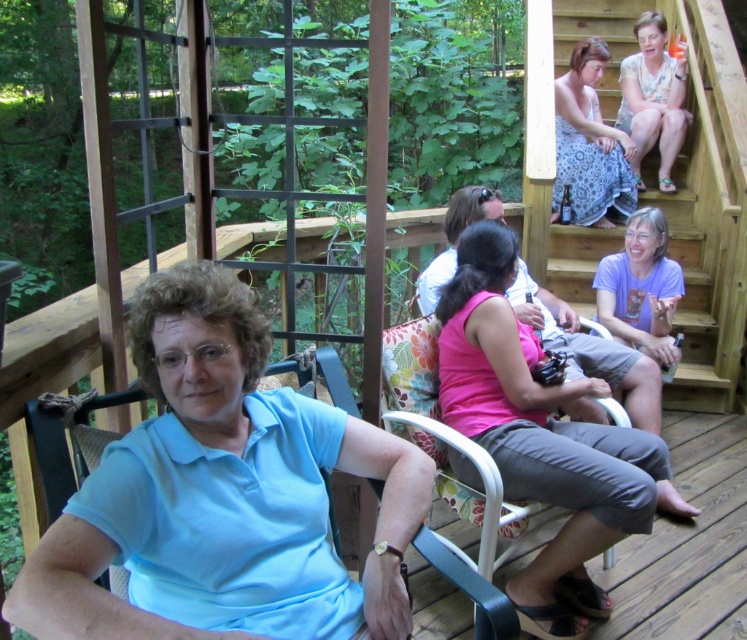
You are standing on the wooden deck and want to go up the wooden stairs at upper right. There is a patterned fabric dress at upper right nearby. Which direction should you move relative to the dress to reach the stairs?

To reach the wooden stairs at upper right from the patterned fabric dress at upper right, you should move to the right since the stairs are located to the right of the dress.

You are a photographer setting up a shoot on the deck. You have two outfits to choose from for the model to wear. The outfits are the patterned fabric dress at upper right and the purple cotton shirt at lower right. Based on their heights, which outfit would you recommend to ensure the model can comfortably sit on the deck chair without the top of the outfit hitting the railing?

The patterned fabric dress at upper right has a greater height compared to the purple cotton shirt at lower right, so the purple cotton shirt at lower right would be more comfortable for sitting on the deck chair without the top hitting the railing.